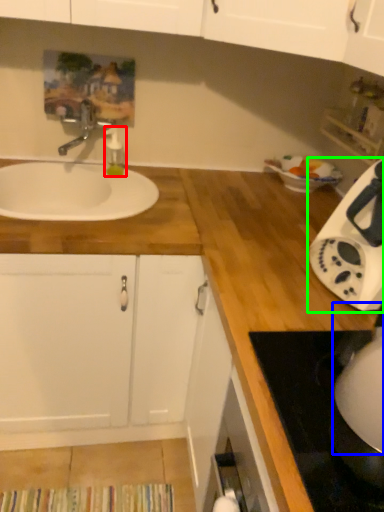
Question: Which object is positioned closest to soap dispenser (highlighted by a red box)? Select from appliance (highlighted by a blue box) and home appliance (highlighted by a green box).

Choices:
 (A) appliance
 (B) home appliance

Answer: (B)